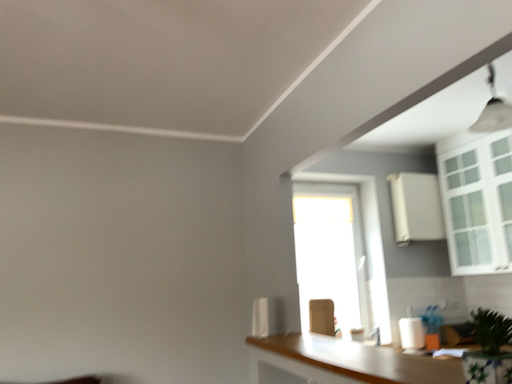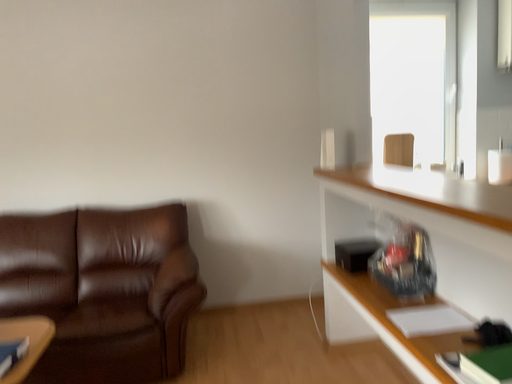
Question: Which way did the camera rotate in the video?

Choices:
 (A) rotated upward
 (B) rotated downward

Answer: (B)